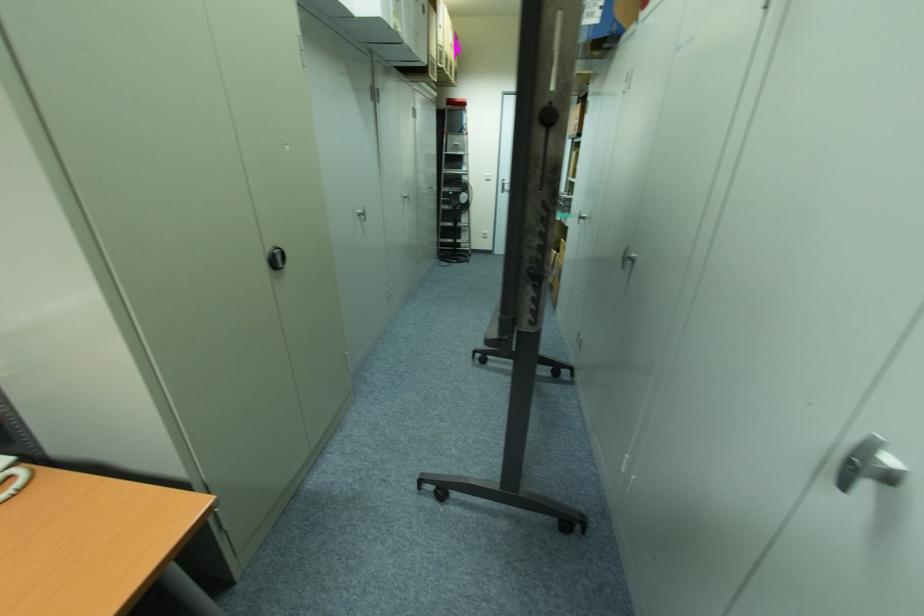
The height and width of the screenshot is (616, 924). What are the coordinates of `black cabinet handle` in the screenshot? It's located at (275, 257).